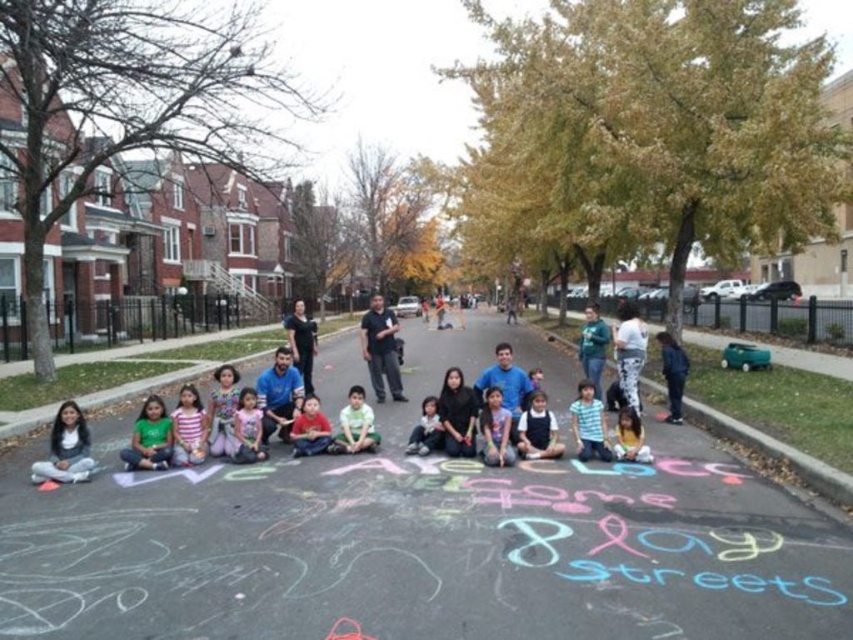
You are a photographer trying to capture a group photo of the matte white shirt at lower left and the matte yellow shirt at center. Which shirt should you focus on first if you want to ensure both are in focus, considering their sizes?

The matte white shirt at lower left is larger than the matte yellow shirt at center, so focusing on the matte white shirt at lower left first would help ensure both are in focus since it occupies more space in the frame.

You are a photographer taking a picture of the scene described. You notice a point at coordinates (67, 449). Based on the scene description, what object or part of the scene is this point likely located on?

The point at coordinates (67, 449) is located on the matte white shirt at lower left.

You are standing on the street where the children are playing and want to place a 1 meter wide picnic blanket. The black asphalt at center is at point 0.844, 0.497. Is there enough space to place the blanket without overlapping the asphalt?

The black asphalt at center is located at point [422,540]. Since the question does not provide information about the size or dimensions of the street or the surrounding areas, it is impossible to determine if there is enough space to place the picnic blanket without overlapping the asphalt.